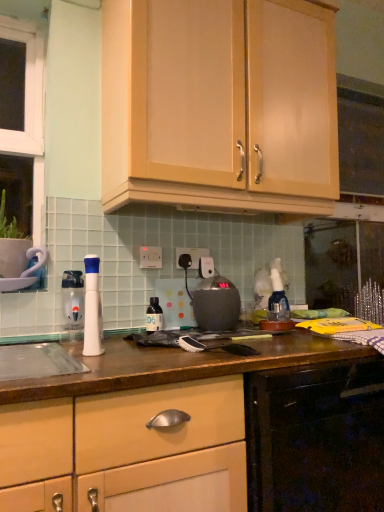
Question: From the image's perspective, is matte wood cabinet at upper center, the 2th cabinetry in the bottom-to-top sequence, below translucent plastic bottle at center, acting as the first bottle starting from the right?

Choices:
 (A) no
 (B) yes

Answer: (A)

Question: Is matte wood cabinet at upper center, the 2th cabinetry in the bottom-to-top sequence, surrounding translucent plastic bottle at center, which is the 2th bottle in front-to-back order?

Choices:
 (A) yes
 (B) no

Answer: (B)

Question: From a real-world perspective, is matte wood cabinet at upper center, the 2th cabinetry in the bottom-to-top sequence, physically below translucent plastic bottle at center, which is the 2th bottle in front-to-back order?

Choices:
 (A) yes
 (B) no

Answer: (B)

Question: Can you confirm if matte wood cabinet at upper center, the 2th cabinetry in the bottom-to-top sequence, is taller than translucent plastic bottle at center, the 2th bottle from the left?

Choices:
 (A) yes
 (B) no

Answer: (A)

Question: Is matte wood cabinet at upper center, the 2th cabinetry in the bottom-to-top sequence, wider than translucent plastic bottle at center, which is the 2th bottle in front-to-back order?

Choices:
 (A) yes
 (B) no

Answer: (A)

Question: In terms of height, does white plastic electric outlet at center, the second electric outlet from the front, look taller or shorter compared to wooden drawer at center, placed as the second cabinetry when sorted from top to bottom?

Choices:
 (A) tall
 (B) short

Answer: (B)

Question: Is white plastic electric outlet at center, the second electric outlet from the front, in front of or behind wooden drawer at center, the 1th cabinetry ordered from the bottom, in the image?

Choices:
 (A) front
 (B) behind

Answer: (B)

Question: In terms of size, does white plastic electric outlet at center, the 1th electric outlet from the right, appear bigger or smaller than wooden drawer at center, placed as the second cabinetry when sorted from top to bottom?

Choices:
 (A) small
 (B) big

Answer: (A)

Question: Considering the positions of point [190, 250] and point [96, 487], is point [190, 250] closer or farther from the camera than point [96, 487]?

Choices:
 (A) farther
 (B) closer

Answer: (A)

Question: In terms of width, does translucent plastic bottle at center, the 2th bottle from the left, look wider or thinner when compared to wooden drawer at center, placed as the second cabinetry when sorted from top to bottom?

Choices:
 (A) thin
 (B) wide

Answer: (A)

Question: From their relative heights in the image, would you say translucent plastic bottle at center, the 2th bottle from the left, is taller or shorter than wooden drawer at center, the 1th cabinetry ordered from the bottom?

Choices:
 (A) short
 (B) tall

Answer: (A)

Question: Visually, is translucent plastic bottle at center, the 2th bottle from the left, positioned to the left or to the right of wooden drawer at center, placed as the second cabinetry when sorted from top to bottom?

Choices:
 (A) right
 (B) left

Answer: (B)

Question: Would you say translucent plastic bottle at center, acting as the first bottle starting from the right, is inside or outside wooden drawer at center, the 1th cabinetry ordered from the bottom?

Choices:
 (A) inside
 (B) outside

Answer: (B)

Question: Based on their sizes in the image, would you say matte black kettle at center is bigger or smaller than wooden drawer at center, the 1th cabinetry ordered from the bottom?

Choices:
 (A) big
 (B) small

Answer: (B)

Question: Based on their positions, is matte black kettle at center located to the left or right of wooden drawer at center, placed as the second cabinetry when sorted from top to bottom?

Choices:
 (A) left
 (B) right

Answer: (A)